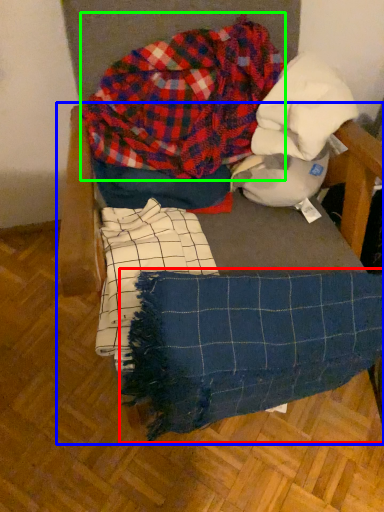
Question: Which is nearer to the blanket (highlighted by a red box)? furniture (highlighted by a blue box) or flannel (highlighted by a green box).

Choices:
 (A) furniture
 (B) flannel

Answer: (A)